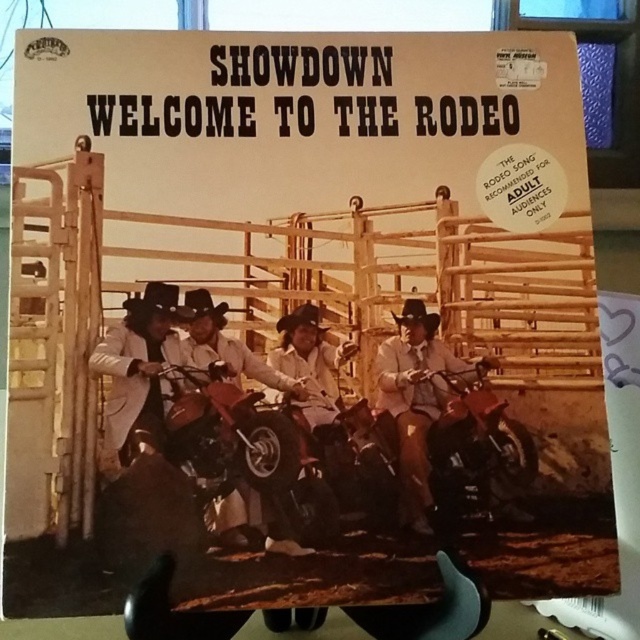
You are designing a digital overlay for the vinyl record cover. The artwork requires placing a small logo exactly at the center of the image. However, you need to ensure that the logo does not cover the black felt cowboy hat at center. Given the coordinates provided, can you determine if the logo placement at the center will overlap with the hat?

The black felt cowboy hat at center is located at point (200, 307). Since the logo is placed exactly at the center of the image, which is typically at coordinates (320, 320), the logo will not overlap with the hat as its coordinates are slightly offset to the left and down from the true center.

You are a photographer setting up for a photoshoot. You need to place a 15 cm wide prop between the light brown leather jacket at center and the brown felt cowboy hat at center. Based on the scene, will there be enough space between them to fit the prop?

The distance between the light brown leather jacket at center and the brown felt cowboy hat at center is 16.99 centimeters. Since the prop is 15 cm wide, there is sufficient space to place it between them.

You are a photographer taking a picture of the album cover. You notice the light brown leather jacket at center and the black matte cowboy hat at center. Which object is located to the right of the other?

The light brown leather jacket at center is positioned on the right side of black matte cowboy hat at center.